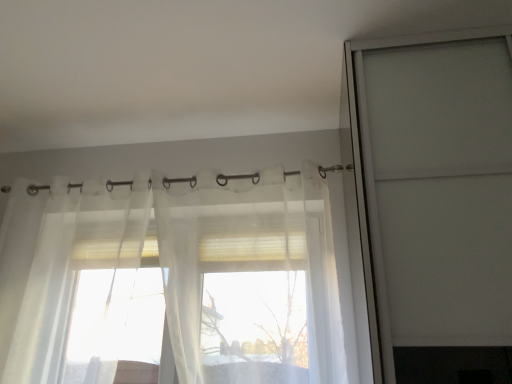
Question: Does sheer white curtain at center have a larger size compared to transparent glass screen door at upper right?

Choices:
 (A) no
 (B) yes

Answer: (A)

Question: From a real-world perspective, does sheer white curtain at center stand above transparent glass screen door at upper right?

Choices:
 (A) yes
 (B) no

Answer: (B)

Question: Considering the relative sizes of sheer white curtain at center and transparent glass screen door at upper right in the image provided, is sheer white curtain at center smaller than transparent glass screen door at upper right?

Choices:
 (A) no
 (B) yes

Answer: (B)

Question: Considering the relative positions of sheer white curtain at center and transparent glass screen door at upper right in the image provided, is sheer white curtain at center to the left of transparent glass screen door at upper right from the viewer's perspective?

Choices:
 (A) yes
 (B) no

Answer: (A)

Question: From the image's perspective, is sheer white curtain at center on top of transparent glass screen door at upper right?

Choices:
 (A) no
 (B) yes

Answer: (A)

Question: From the image's perspective, would you say sheer white curtain at center is shown under transparent glass screen door at upper right?

Choices:
 (A) no
 (B) yes

Answer: (B)

Question: Can you confirm if translucent fabric curtain at upper center is bigger than transparent glass screen door at upper right?

Choices:
 (A) no
 (B) yes

Answer: (A)

Question: Is transparent glass screen door at upper right at the back of translucent fabric curtain at upper center?

Choices:
 (A) no
 (B) yes

Answer: (A)

Question: Is the position of translucent fabric curtain at upper center more distant than that of transparent glass screen door at upper right?

Choices:
 (A) yes
 (B) no

Answer: (A)

Question: From the image's perspective, is translucent fabric curtain at upper center located above transparent glass screen door at upper right?

Choices:
 (A) yes
 (B) no

Answer: (A)

Question: Is translucent fabric curtain at upper center next to transparent glass screen door at upper right and touching it?

Choices:
 (A) yes
 (B) no

Answer: (B)

Question: Would you say translucent fabric curtain at upper center is a long distance from transparent glass screen door at upper right?

Choices:
 (A) yes
 (B) no

Answer: (B)

Question: From the image's perspective, is transparent glass screen door at upper right on top of sheer white curtain at center?

Choices:
 (A) yes
 (B) no

Answer: (A)